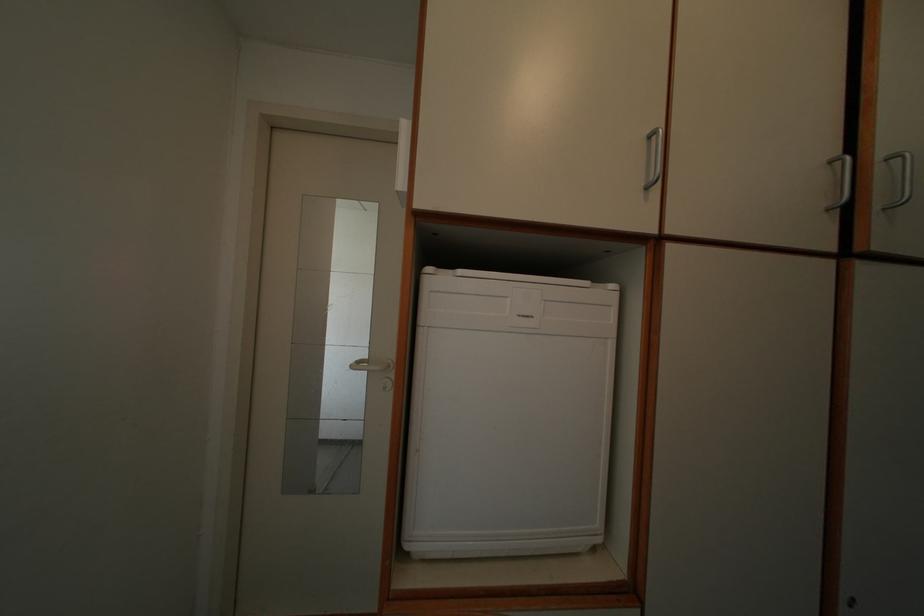
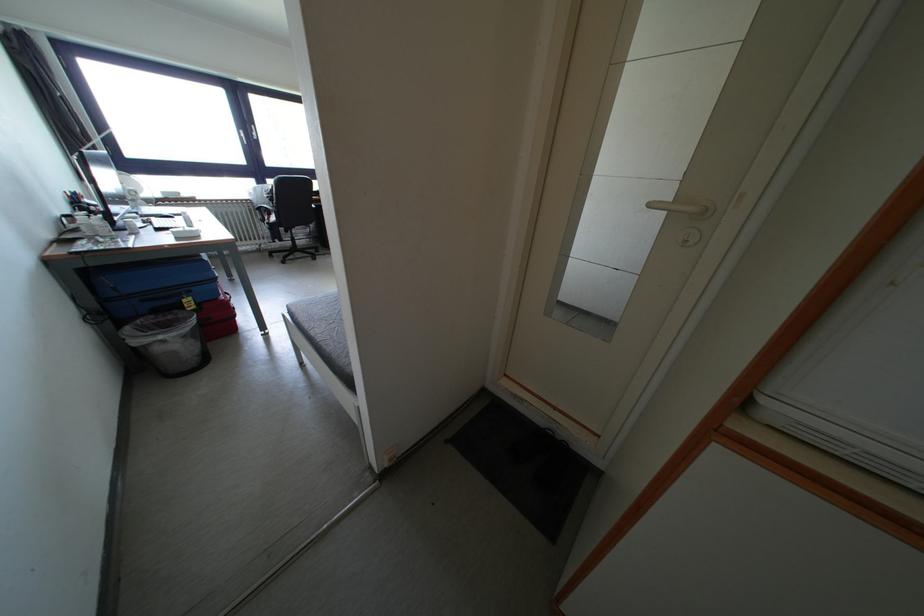
How did the camera likely rotate?

The camera's rotation is toward left-down.